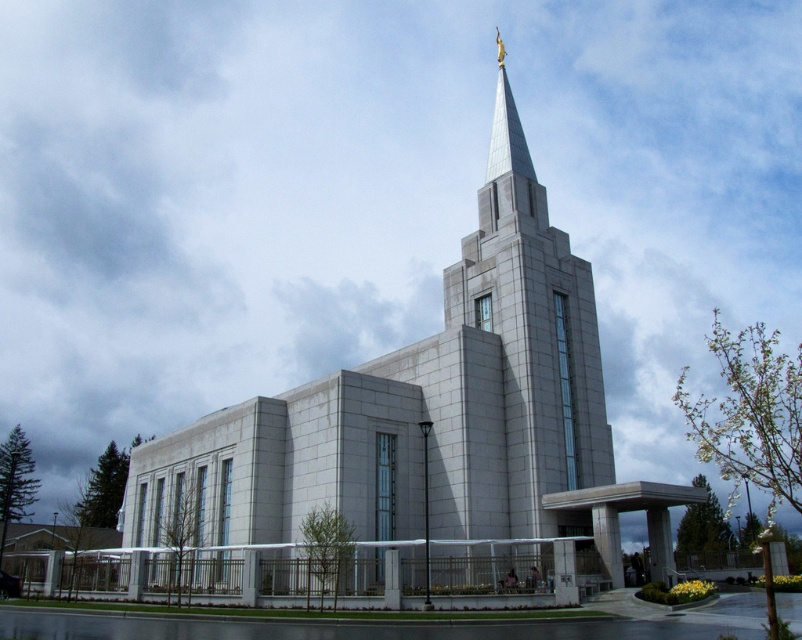
Question: From the image, what is the correct spatial relationship of white stone church at center in relation to white stone spire at center?

Choices:
 (A) below
 (B) above

Answer: (A)

Question: Does white stone church at center come behind white stone spire at center?

Choices:
 (A) yes
 (B) no

Answer: (B)

Question: Which of the following is the closest to the observer?

Choices:
 (A) (573, 428)
 (B) (525, 248)

Answer: (A)

Question: Does white stone church at center appear over white stone spire at center?

Choices:
 (A) no
 (B) yes

Answer: (A)

Question: Which of the following is the farthest from the observer?

Choices:
 (A) (576, 493)
 (B) (363, 440)

Answer: (B)